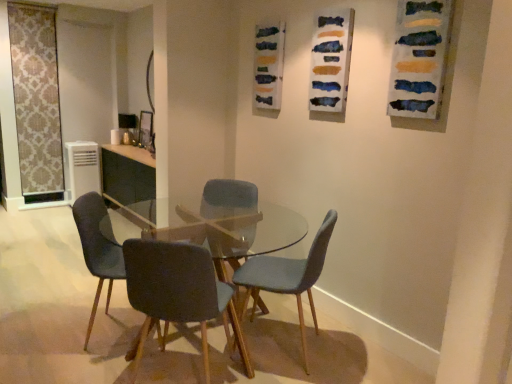
Question: From a real-world perspective, is velvet blue chair at center, the 3th chair in the left-to-right sequence, positioned above or below velvet dark blue chair at center, acting as the 1th chair starting from the left?

Choices:
 (A) above
 (B) below

Answer: (A)

Question: Is velvet blue chair at center, the 3th chair in the left-to-right sequence, inside the boundaries of velvet dark blue chair at center, acting as the 1th chair starting from the left, or outside?

Choices:
 (A) inside
 (B) outside

Answer: (B)

Question: Estimate the real-world distances between objects in this image. Which object is closer to the beige damask fabric at left?

Choices:
 (A) velvet blue chair at center, the 3th chair in the left-to-right sequence
 (B) velvet dark blue chair at center, acting as the 1th chair starting from the left
 (C) white plastic air conditioner at left
 (D) watercolor paint at upper center
 (E) clear glass table at center

Answer: (C)

Question: Which of these objects is positioned closest to the velvet blue chair at center, the 3th chair in the left-to-right sequence?

Choices:
 (A) dark gray fabric chair at center, which appears as the 2th chair when viewed from the left
 (B) watercolor paint at upper center
 (C) velvet dark blue chair at center, which is the 4th chair in right-to-left order
 (D) matte blue fabric chair at center, which is the 1th chair from right to left
 (E) clear glass table at center

Answer: (E)